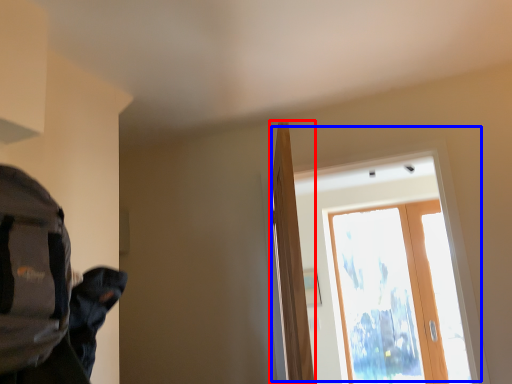
Question: Among these objects, which one is farthest to the camera, door (highlighted by a red box) or window (highlighted by a blue box)?

Choices:
 (A) door
 (B) window

Answer: (B)